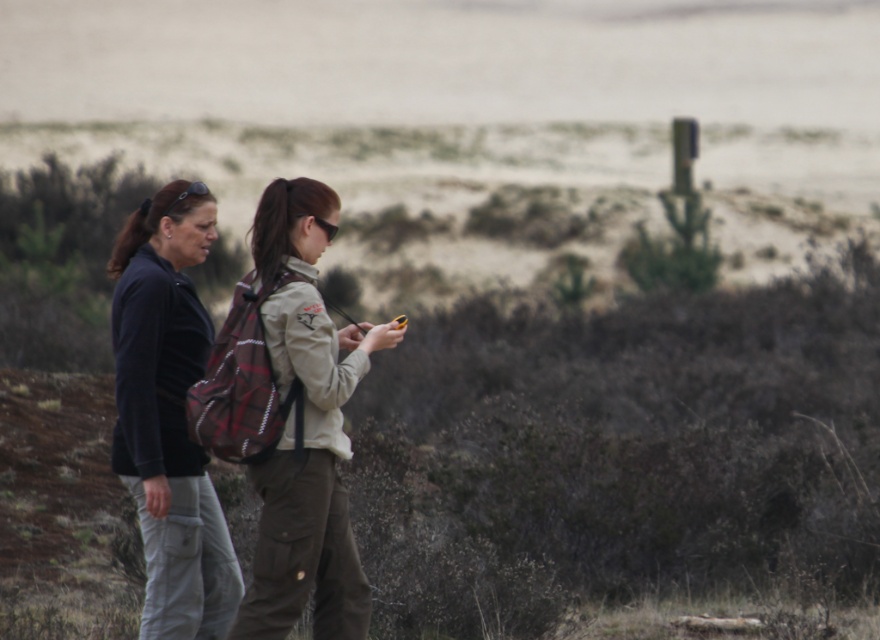
Which of these two, plaid fabric backpack at center or dark blue fleece jacket at left, stands taller?

Standing taller between the two is plaid fabric backpack at center.

Between plaid fabric backpack at center and dark blue fleece jacket at left, which one appears on the left side from the viewer's perspective?

dark blue fleece jacket at left

Does point (297, 360) lie behind point (151, 372)?

No, it is not.

This screenshot has height=640, width=880. What are the coordinates of `plaid fabric backpack at center` in the screenshot? It's located at (167, 416).